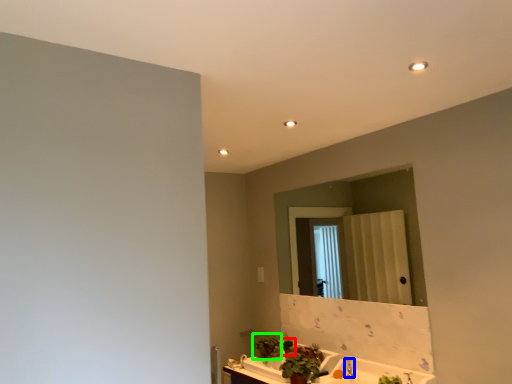
Question: Which is farther away from plant (highlighted by a red box)? faucet (highlighted by a blue box) or plant (highlighted by a green box)?

Choices:
 (A) faucet
 (B) plant

Answer: (A)